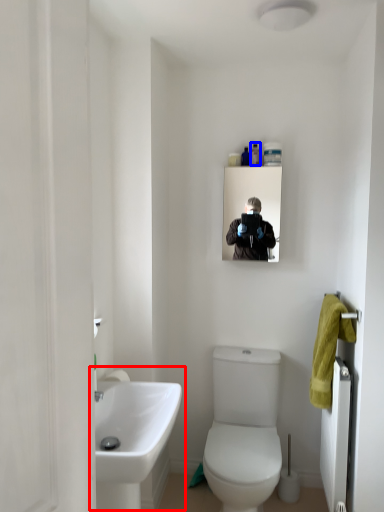
Question: Which of the following is the closest to the observer, sink (highlighted by a red box) or toiletry (highlighted by a blue box)?

Choices:
 (A) sink
 (B) toiletry

Answer: (A)